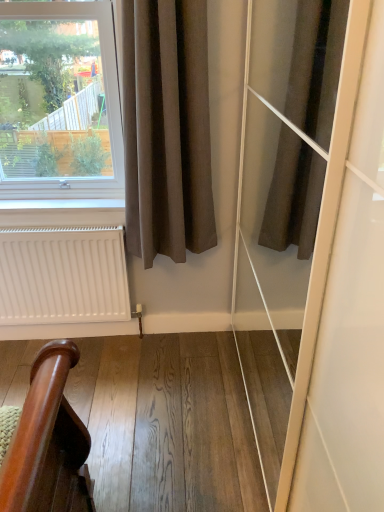
Question: Does white matte radiator at lower left lie in front of wooden handrail at lower left?

Choices:
 (A) no
 (B) yes

Answer: (A)

Question: Does white matte radiator at lower left have a greater width compared to wooden handrail at lower left?

Choices:
 (A) no
 (B) yes

Answer: (A)

Question: From the image's perspective, does white matte radiator at lower left appear higher than wooden handrail at lower left?

Choices:
 (A) no
 (B) yes

Answer: (B)

Question: Would you say white matte radiator at lower left is outside wooden handrail at lower left?

Choices:
 (A) yes
 (B) no

Answer: (A)

Question: Could you tell me if white matte radiator at lower left is facing wooden handrail at lower left?

Choices:
 (A) no
 (B) yes

Answer: (B)

Question: Do you think white matte radiator at lower left is within brown cotton curtain at left, or outside of it?

Choices:
 (A) inside
 (B) outside

Answer: (B)

Question: Is point (105, 251) positioned closer to the camera than point (163, 79)?

Choices:
 (A) farther
 (B) closer

Answer: (A)

Question: From the image's perspective, is white matte radiator at lower left located above or below brown cotton curtain at left?

Choices:
 (A) above
 (B) below

Answer: (B)

Question: Is white matte radiator at lower left taller or shorter than brown cotton curtain at left?

Choices:
 (A) tall
 (B) short

Answer: (B)

Question: Considering the positions of point [x=145, y=462] and point [x=157, y=161], is point [x=145, y=462] closer or farther from the camera than point [x=157, y=161]?

Choices:
 (A) closer
 (B) farther

Answer: (A)

Question: From the image's perspective, relative to brown cotton curtain at left, is wooden handrail at lower left above or below?

Choices:
 (A) above
 (B) below

Answer: (B)

Question: Considering the positions of wooden handrail at lower left and brown cotton curtain at left in the image, is wooden handrail at lower left wider or thinner than brown cotton curtain at left?

Choices:
 (A) thin
 (B) wide

Answer: (B)

Question: In terms of size, does wooden handrail at lower left appear bigger or smaller than brown cotton curtain at left?

Choices:
 (A) big
 (B) small

Answer: (B)

Question: Considering the relative positions of white matte radiator at lower left and wooden handrail at lower left in the image provided, is white matte radiator at lower left to the left or to the right of wooden handrail at lower left?

Choices:
 (A) left
 (B) right

Answer: (A)

Question: Is white matte radiator at lower left wider or thinner than wooden handrail at lower left?

Choices:
 (A) thin
 (B) wide

Answer: (A)